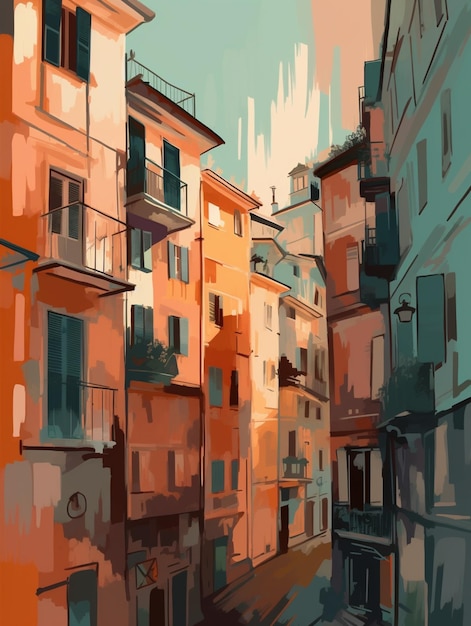
Where is `chimney`? The image size is (471, 626). chimney is located at coordinates (273, 200).